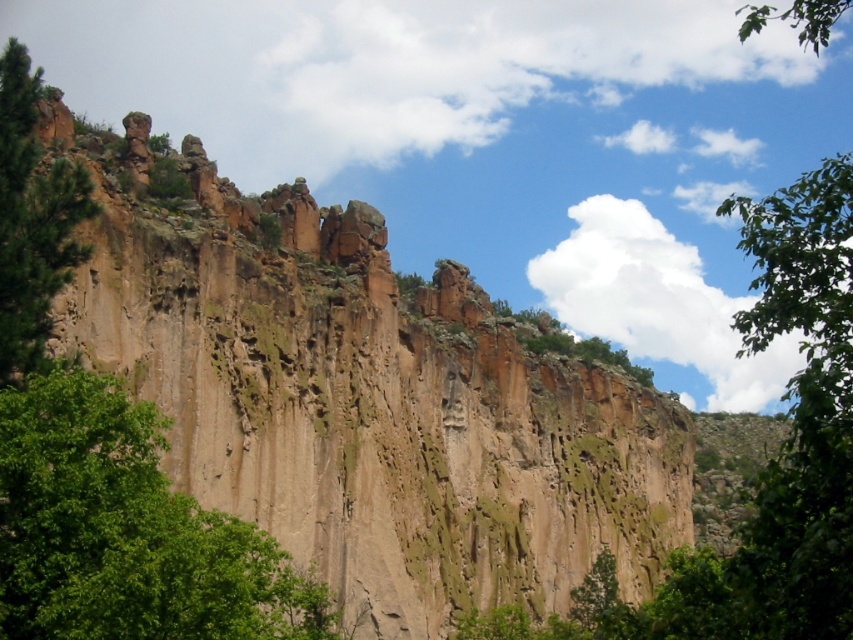
Question: Which of these objects is positioned farthest from the green leafy tree at center?

Choices:
 (A) brown rough rock at center
 (B) green rough bark tree at left

Answer: (A)

Question: Where is brown rough rock at center located in relation to green leafy tree at center in the image?

Choices:
 (A) above
 (B) below

Answer: (A)

Question: Among these objects, which one is nearest to the camera?

Choices:
 (A) green rough bark tree at left
 (B) brown rough rock at center

Answer: (B)

Question: Which of the following is the farthest from the observer?

Choices:
 (A) (20, 259)
 (B) (631, 394)

Answer: (B)

Question: Is green leafy tree at center further to the viewer compared to green rough bark tree at left?

Choices:
 (A) no
 (B) yes

Answer: (A)

Question: Is green leafy tree at center further to the viewer compared to green rough bark tree at left?

Choices:
 (A) no
 (B) yes

Answer: (A)